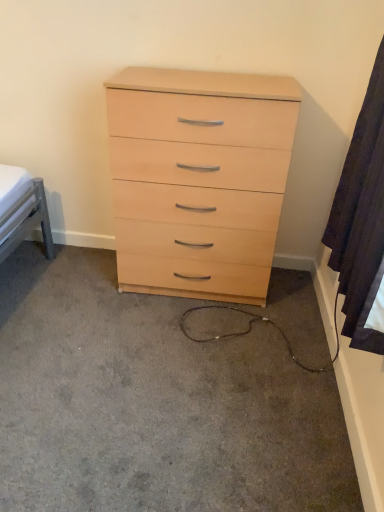
Question: Based on their sizes in the image, would you say dark fabric curtain at right is bigger or smaller than light wood dresser at center?

Choices:
 (A) small
 (B) big

Answer: (A)

Question: Is point (352, 181) closer or farther from the camera than point (187, 450)?

Choices:
 (A) closer
 (B) farther

Answer: (A)

Question: Which is farther from the dark fabric curtain at right?

Choices:
 (A) light wood/veneer chest of drawers at center
 (B) light wood dresser at center

Answer: (B)

Question: Which object is positioned closest to the light wood/veneer chest of drawers at center?

Choices:
 (A) light wood dresser at center
 (B) dark fabric curtain at right

Answer: (B)